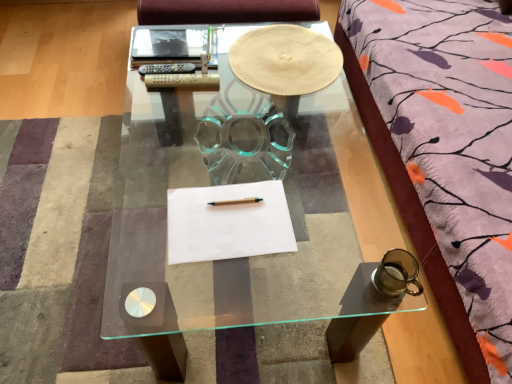
Question: Is white paper at upper center, acting as the 2th notebook starting from the bottom, oriented towards wooden pencil at center?

Choices:
 (A) no
 (B) yes

Answer: (A)

Question: Is white paper at upper center, acting as the 2th notebook starting from the bottom, looking in the opposite direction of wooden pencil at center?

Choices:
 (A) yes
 (B) no

Answer: (B)

Question: Does white paper at upper center, the 2th notebook when ordered from front to back, appear on the right side of wooden pencil at center?

Choices:
 (A) yes
 (B) no

Answer: (B)

Question: Can you confirm if white paper at upper center, acting as the 2th notebook starting from the bottom, is thinner than wooden pencil at center?

Choices:
 (A) yes
 (B) no

Answer: (B)

Question: Considering the relative sizes of white paper at upper center, acting as the 2th notebook starting from the bottom, and wooden pencil at center in the image provided, is white paper at upper center, acting as the 2th notebook starting from the bottom, shorter than wooden pencil at center?

Choices:
 (A) no
 (B) yes

Answer: (A)

Question: From the image's perspective, would you say white paper at upper center, positioned as the first notebook in back-to-front order, is shown under wooden pencil at center?

Choices:
 (A) yes
 (B) no

Answer: (B)

Question: Does transparent glass coffee table at center touch wooden pencil at center?

Choices:
 (A) no
 (B) yes

Answer: (A)

Question: From the image's perspective, does transparent glass coffee table at center appear lower than wooden pencil at center?

Choices:
 (A) yes
 (B) no

Answer: (B)

Question: Does transparent glass coffee table at center have a greater height compared to wooden pencil at center?

Choices:
 (A) yes
 (B) no

Answer: (A)

Question: Is transparent glass coffee table at center to the left of wooden pencil at center from the viewer's perspective?

Choices:
 (A) yes
 (B) no

Answer: (A)

Question: Is wooden pencil at center surrounded by transparent glass coffee table at center?

Choices:
 (A) no
 (B) yes

Answer: (A)

Question: Is transparent glass coffee table at center looking in the opposite direction of wooden pencil at center?

Choices:
 (A) no
 (B) yes

Answer: (A)

Question: From the image's perspective, is white paper at center, which is the first notebook from bottom to top, on top of wooden pencil at center?

Choices:
 (A) yes
 (B) no

Answer: (B)